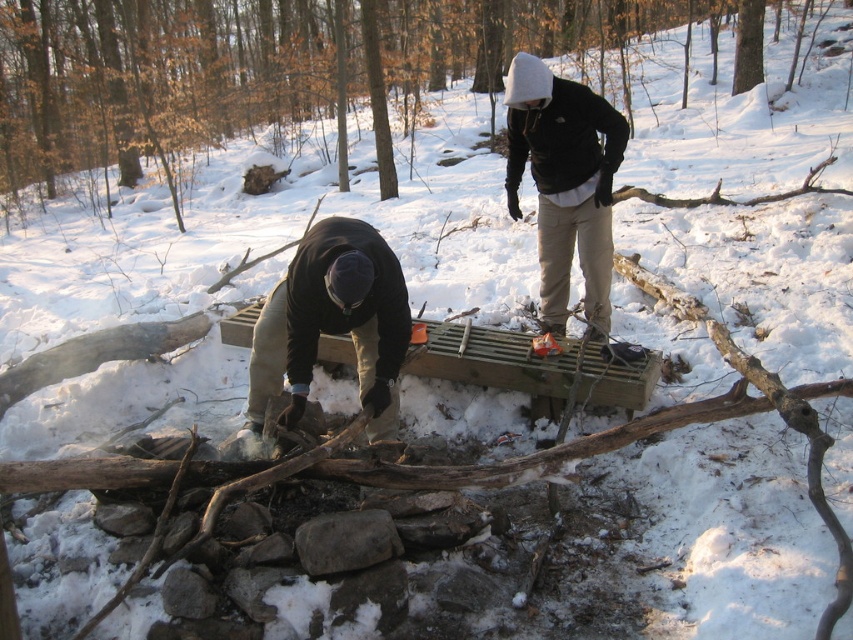
Question: Can you confirm if smooth brown log at center is wider than brown woolen sweater at lower left?

Choices:
 (A) no
 (B) yes

Answer: (B)

Question: Can you confirm if smooth brown log at center is wider than dark gray fleece jacket at upper center?

Choices:
 (A) yes
 (B) no

Answer: (A)

Question: Is the position of brown woolen sweater at lower left less distant than that of dark gray fleece jacket at upper center?

Choices:
 (A) no
 (B) yes

Answer: (B)

Question: Which point is closer to the camera?

Choices:
 (A) smooth brown log at center
 (B) dark gray fleece jacket at upper center
 (C) brown woolen sweater at lower left

Answer: (C)

Question: Which point is closer to the camera?

Choices:
 (A) dark gray fleece jacket at upper center
 (B) smooth brown log at center

Answer: (A)

Question: Estimate the real-world distances between objects in this image. Which object is closer to the smooth brown log at center?

Choices:
 (A) brown woolen sweater at lower left
 (B) dark gray fleece jacket at upper center

Answer: (A)